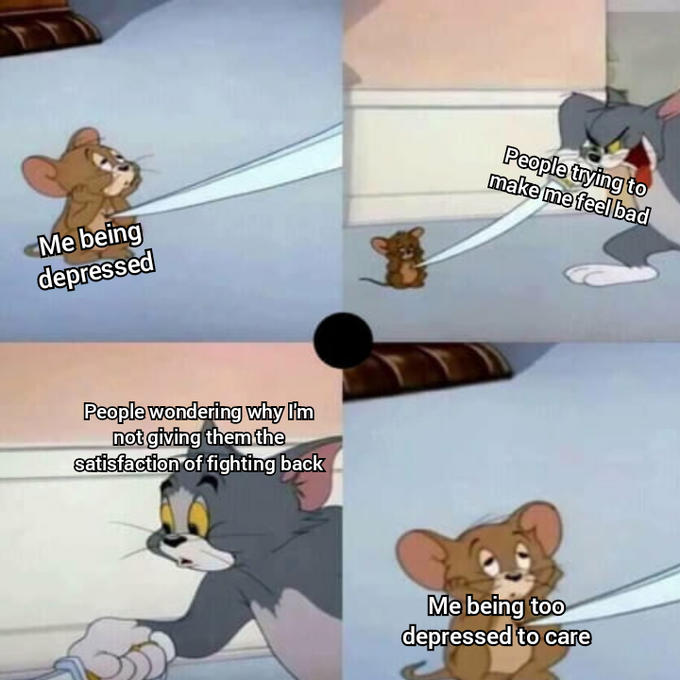
This screenshot has width=680, height=680. What are the coordinates of `handle` in the screenshot? It's located at (566, 185), (94, 668).